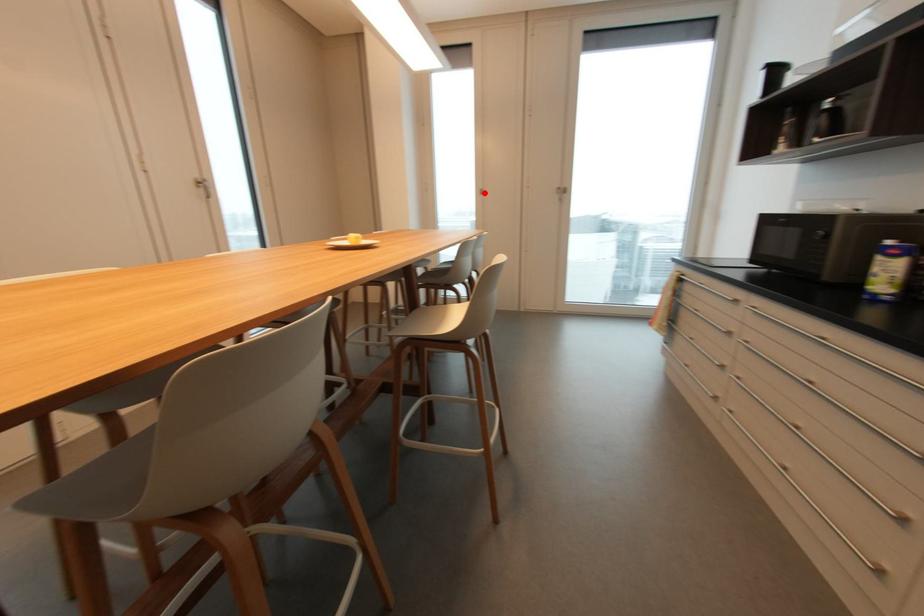
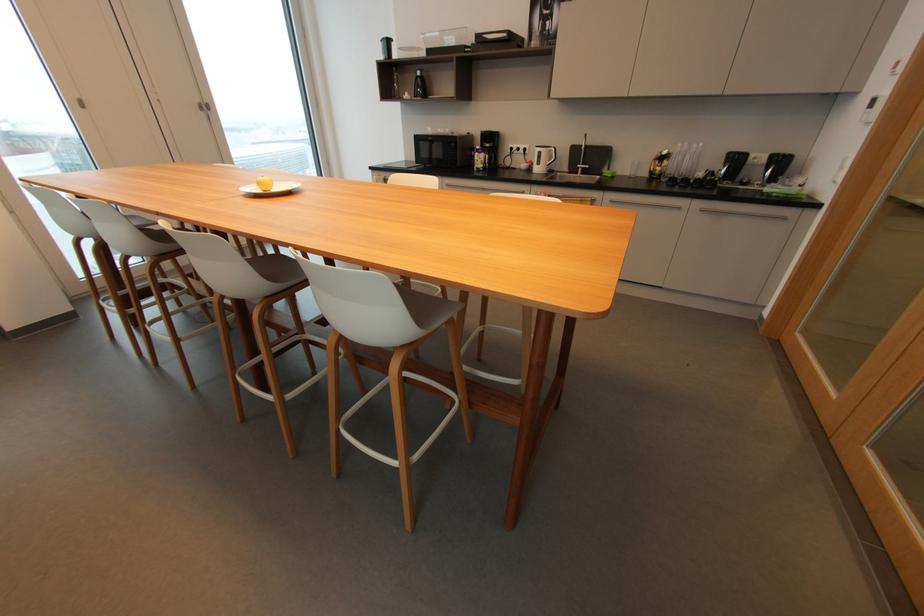
Question: I am providing you with two images of the same scene from different viewpoints. Given a red point in image1, look at the same physical point in image2. Is it:

Choices:
 (A) Closer to the viewpoint
 (B) Farther from the viewpoint

Answer: (A)